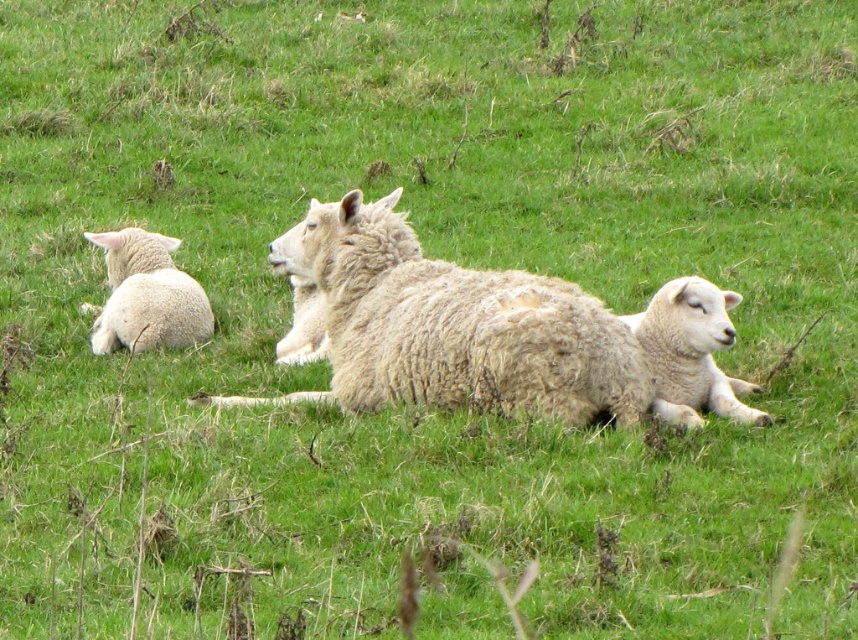
You are a farmer checking the health of your sheep. You notice the white woolen lamb at center and the white woolen lamb at left. Which lamb might be younger based on their sizes?

The white woolen lamb at center has a lesser height compared to the white woolen lamb at left, so the white woolen lamb at center might be younger.

You are a photographer trying to capture the sheep in the center. You notice two points marked in the image. The first point is at coordinates point (x=331, y=324), and the second is at point (x=172, y=237). Which of these points is closer to the camera, and thus would be better for focusing your lens?

Point (x=331, y=324) is closer to the camera than point (x=172, y=237), so it would be better for focusing your lens.